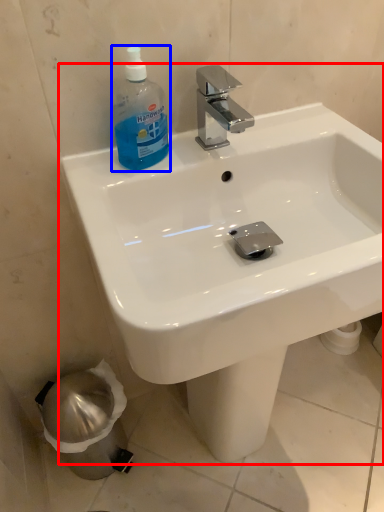
Question: Which object appears farthest to the camera in this image, sink (highlighted by a red box) or cleaning product (highlighted by a blue box)?

Choices:
 (A) sink
 (B) cleaning product

Answer: (B)